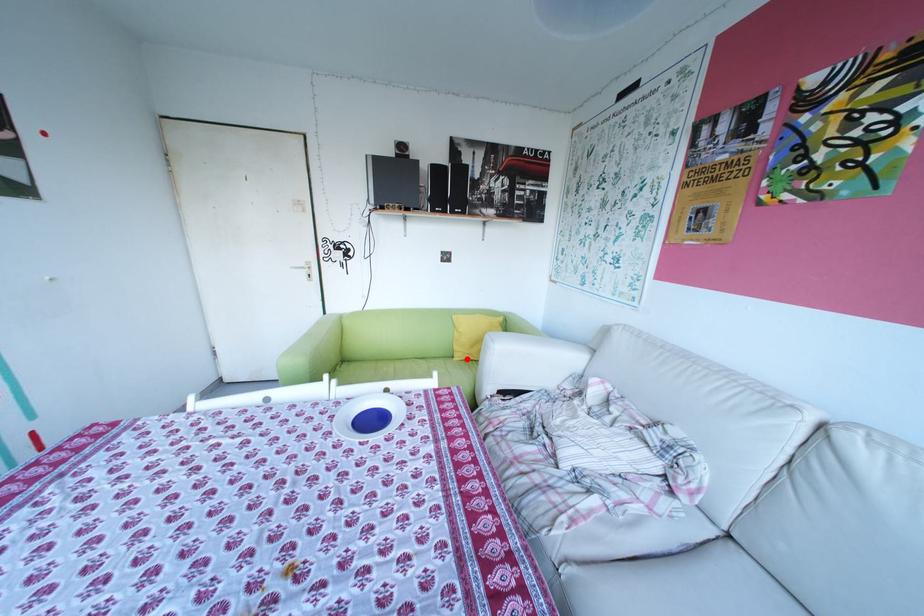
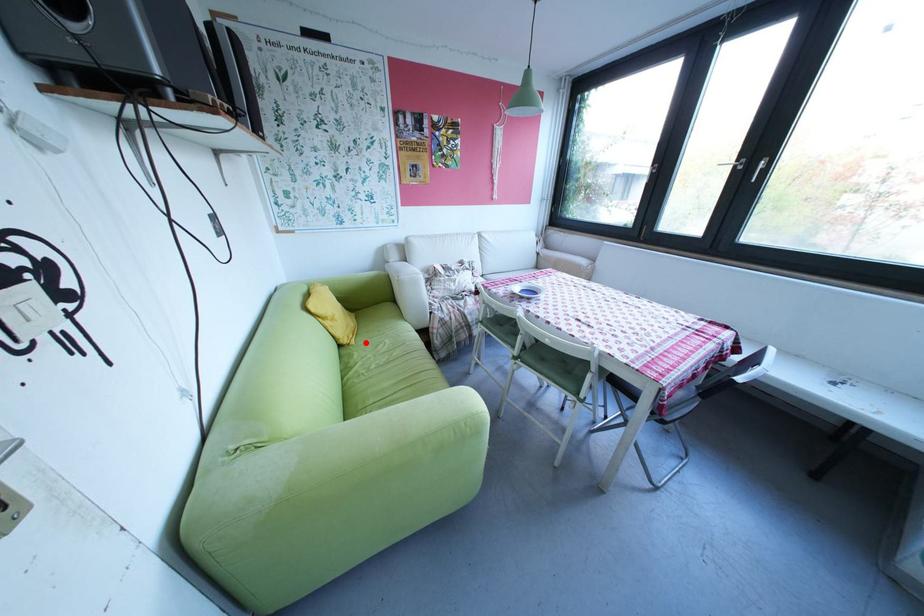
I am providing you with two images of the same scene from different viewpoints. A red point is marked on the first image and another point is marked on the second image. Does the point marked in image1 correspond to the same location as the one in image2?

Yes